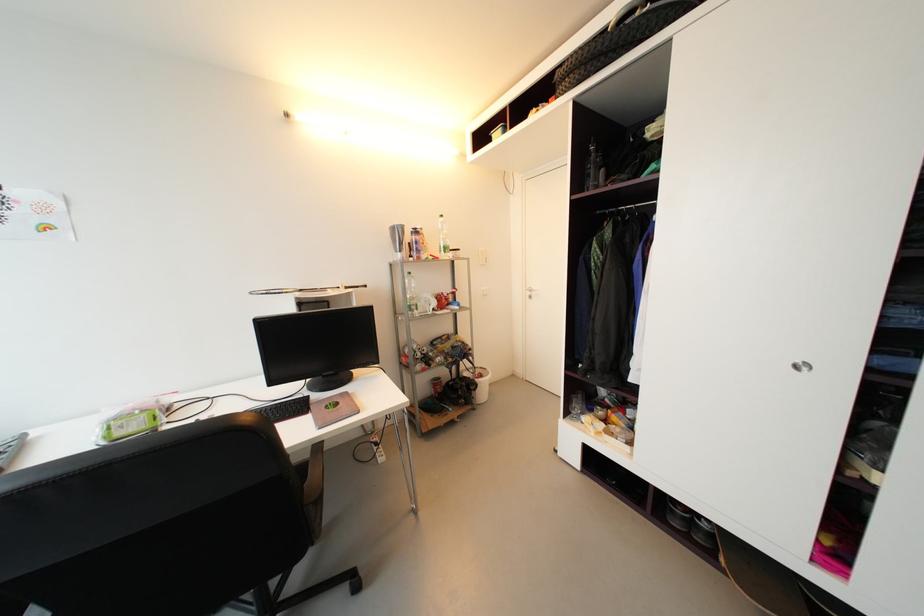
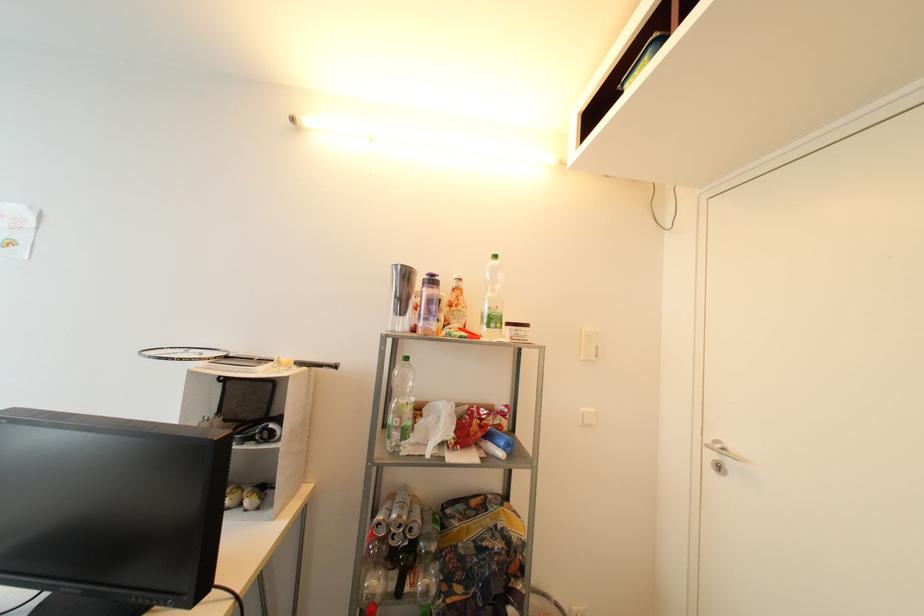
In the second image, find the point that corresponds to point (420, 233) in the first image.

(438, 283)